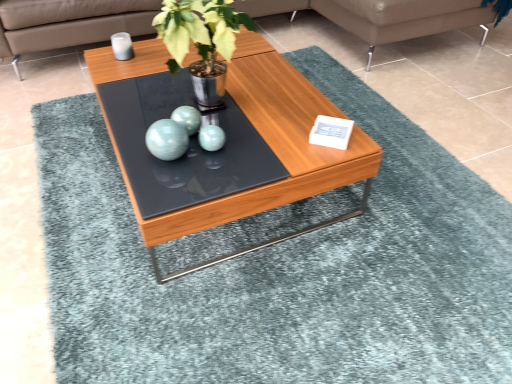
The width and height of the screenshot is (512, 384). I want to click on vacant space that is to the left of teal glossy sphere at center, so click(130, 146).